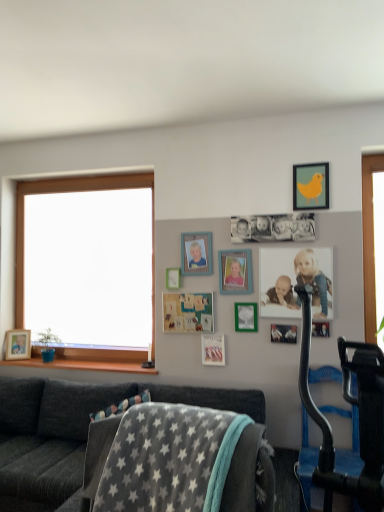
Question: From the image's perspective, is wooden picture frame at upper center, marked as the first picture frame in a right-to-left arrangement, positioned above or below wooden at left?

Choices:
 (A) below
 (B) above

Answer: (B)

Question: Is wooden picture frame at upper center, the 11th picture frame from the left, taller or shorter than wooden at left?

Choices:
 (A) tall
 (B) short

Answer: (A)

Question: Based on their relative distances, which object is nearer to the matte wooden picture frame at lower left, acting as the 11th picture frame starting from the right?

Choices:
 (A) matte yellow bird at upper right, which is the ninth picture frame in back-to-front order
 (B) green matte picture frame at upper center, the seventh picture frame when ordered from left to right
 (C) black plastic exercise machine at right
 (D) matte plastic picture frame at center, the 7th picture frame positioned from the right
 (E) matte white photo frame at center, which ranks as the first picture frame in front-to-back order

Answer: (D)

Question: Which object is the closest to the black plastic exercise machine at right?

Choices:
 (A) velvet dark gray couch at lower left
 (B) metallic silver photo frame at center, the eighth picture frame in the back-to-front sequence
 (C) matte yellow bird at upper right, which ranks as the 3th picture frame in front-to-back order
 (D) matte wooden picture frame at lower left, which is the 1th picture frame in back-to-front order
 (E) matte plastic picture frame at center, the 7th picture frame positioned from the right

Answer: (B)